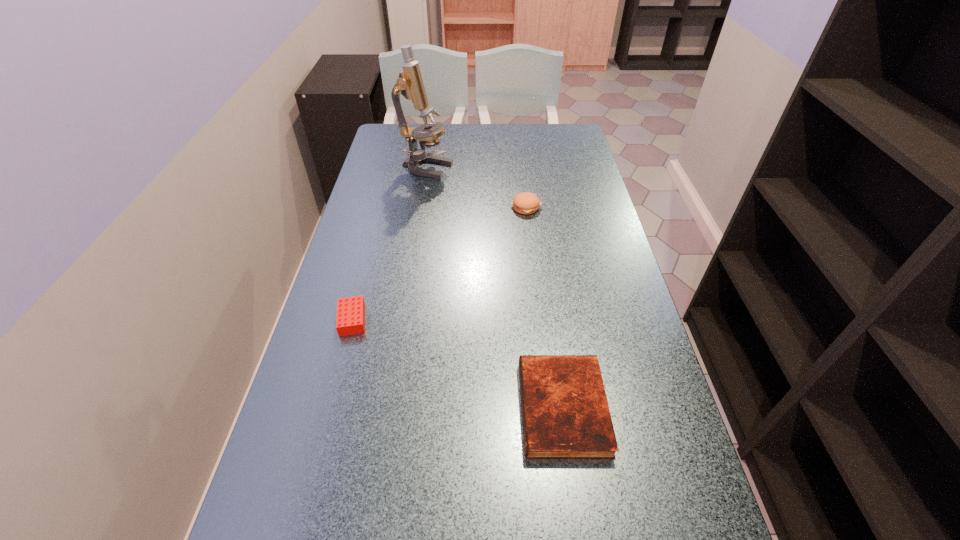
Identify the location of microscope. This screenshot has width=960, height=540. (410, 84).

Locate an element on the screen. The width and height of the screenshot is (960, 540). the farthest object is located at coordinates (410, 84).

Where is `the second farthest object`? the second farthest object is located at coordinates (526, 203).

Where is `the second nearest object`? The image size is (960, 540). the second nearest object is located at coordinates (350, 319).

At what (x,y) coordinates should I click in order to perform the action: click on Bible. Please return your answer as a coordinate pair (x, y). The height and width of the screenshot is (540, 960). Looking at the image, I should click on (565, 412).

Image resolution: width=960 pixels, height=540 pixels. Identify the location of vacant area located on the back of the tallest object. (432, 134).

What are the coordinates of `free spot located 0.170m on the left of the patty` in the screenshot? It's located at (455, 207).

In order to click on free space located 0.170m on the right of the third farthest object in this screenshot , I will do `click(440, 319)`.

Find the location of a particular element. The image size is (960, 540). free location located on the spine side of the Bible is located at coordinates (352, 408).

The image size is (960, 540). In order to click on vacant area situated on the spine side of the Bible in this screenshot , I will do `click(492, 408)`.